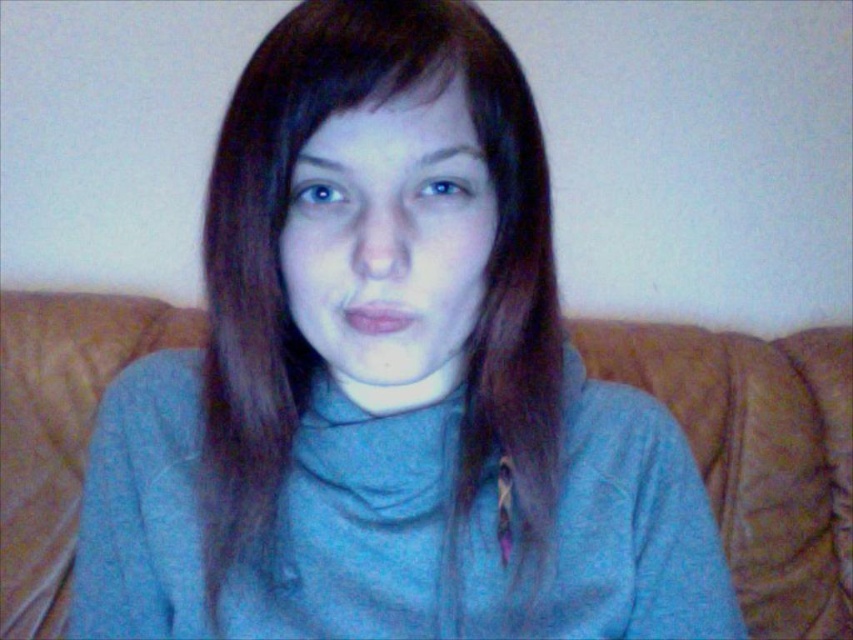
Is matte gray face at center thinner than brown matte hair at upper center?

No.

What do you see at coordinates (390, 234) in the screenshot?
I see `matte gray face at center` at bounding box center [390, 234].

This screenshot has height=640, width=853. Identify the location of matte gray face at center. (390, 234).

Does brown leather couch at center appear on the left side of matte gray face at center?

Incorrect, brown leather couch at center is not on the left side of matte gray face at center.

Is brown leather couch at center smaller than matte gray face at center?

Actually, brown leather couch at center might be larger than matte gray face at center.

Is point (56, 483) in front of point (352, 276)?

No.

The image size is (853, 640). What are the coordinates of `brown leather couch at center` in the screenshot? It's located at (758, 456).

Between brown leather couch at center and brown matte hair at upper center, which one has more height?

Standing taller between the two is brown leather couch at center.

Identify the location of brown leather couch at center. The width and height of the screenshot is (853, 640). (758, 456).